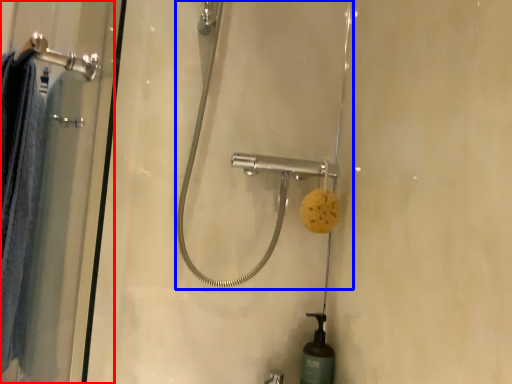
Question: Which object appears closest to the camera in this image, shower door (highlighted by a red box) or shower (highlighted by a blue box)?

Choices:
 (A) shower door
 (B) shower

Answer: (A)